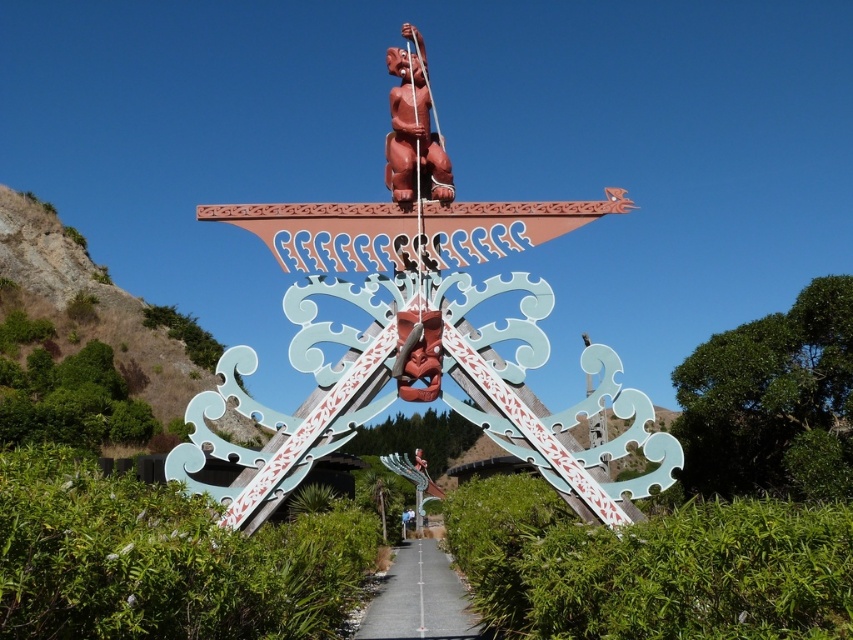
Is matte red totem pole at center to the left of gray concrete path at center from the viewer's perspective?

No, matte red totem pole at center is not to the left of gray concrete path at center.

Who is taller, matte red totem pole at center or gray concrete path at center?

With more height is matte red totem pole at center.

Does point (299, 465) lie behind point (421, 545)?

No, it is not.

You are a GUI agent. You are given a task and a screenshot of the screen. Output one action in this format:
    pyautogui.click(x=<x>, y=<y>)
    Task: Click on the matte red totem pole at center
    
    Given the screenshot: What is the action you would take?
    pyautogui.click(x=419, y=332)

Is green leafy hedge at lower center positioned at the back of matte red totem pole at upper center?

No, green leafy hedge at lower center is closer to the viewer.

Between point (646, 557) and point (416, 68), which one is positioned behind?

The point (416, 68) is more distant.

Image resolution: width=853 pixels, height=640 pixels. Identify the location of green leafy hedge at lower center. (653, 566).

Looking at this image, who is taller, matte red totem pole at center or green leafy hedge at right?

With more height is matte red totem pole at center.

Is point (663, 465) positioned before point (786, 356)?

Yes, it is in front of point (786, 356).

Where is `matte red totem pole at center`? The height and width of the screenshot is (640, 853). matte red totem pole at center is located at coordinates (419, 332).

Find the location of a particular element. matte red totem pole at center is located at coordinates (419, 332).